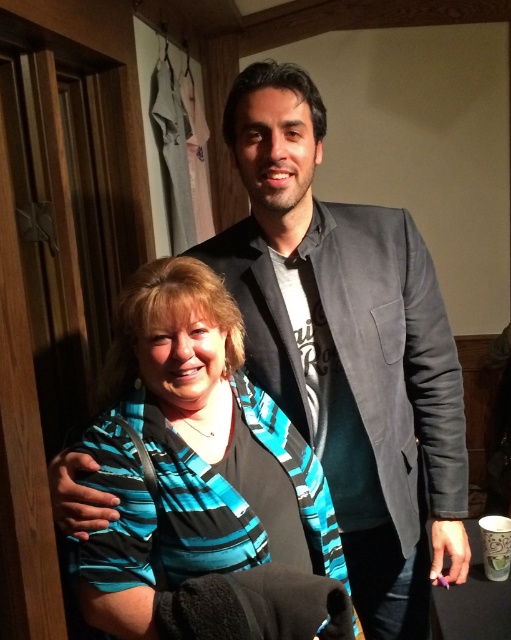
Question: Which object appears farthest from the camera in this image?

Choices:
 (A) teal striped shirt at center
 (B) gray fabric suit at upper center

Answer: (B)

Question: Does gray fabric suit at upper center appear on the right side of teal striped shirt at center?

Choices:
 (A) no
 (B) yes

Answer: (B)

Question: Which point is farther to the camera?

Choices:
 (A) gray fabric suit at upper center
 (B) teal striped shirt at center

Answer: (A)

Question: Does gray fabric suit at upper center appear under teal striped shirt at center?

Choices:
 (A) yes
 (B) no

Answer: (B)

Question: Can you confirm if gray fabric suit at upper center is bigger than teal striped shirt at center?

Choices:
 (A) no
 (B) yes

Answer: (B)

Question: Which of the following is the farthest from the observer?

Choices:
 (A) gray fabric suit at upper center
 (B) teal striped shirt at center

Answer: (A)